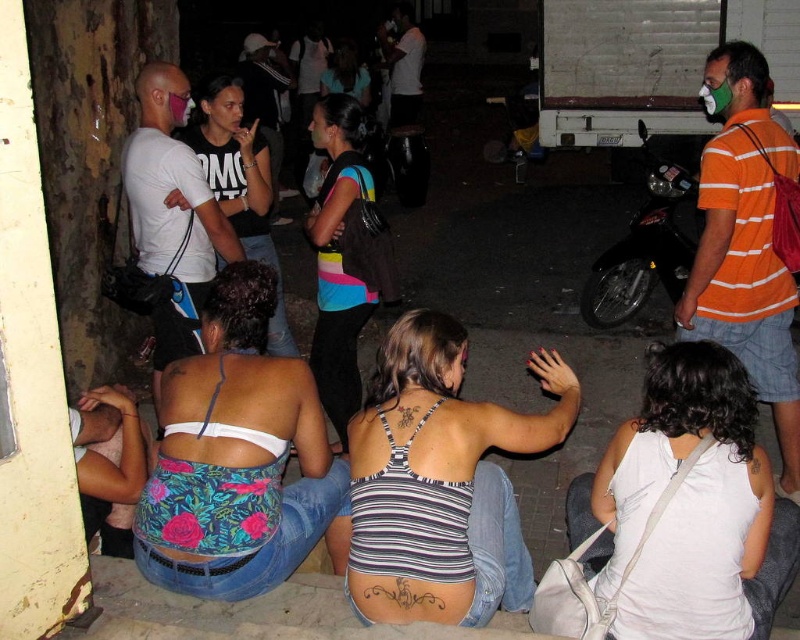
Based on the photo, you are a photographer trying to capture the scene. You notice a point at coordinates (441, 481) in the image. Based on the description, what object is this point located on?

The point at coordinates (441, 481) is located on the striped fabric tank top at center.

You are standing in the scene and want to locate the white fabric tank top at lower right. What are the coordinates where you should look?

The white fabric tank top at lower right is located at coordinates point (690, 502).